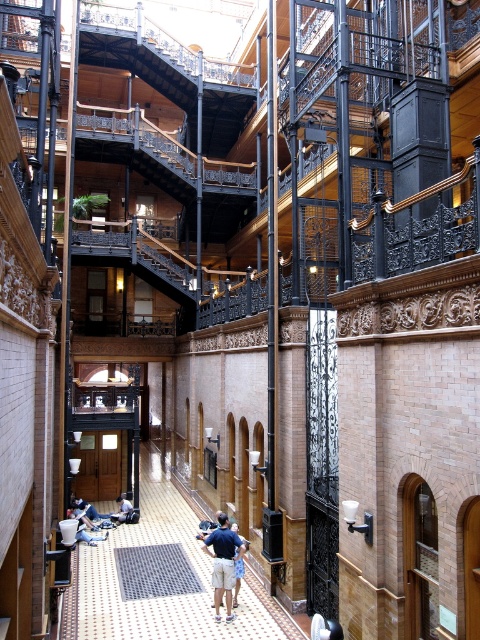
Question: Considering the real-world distances, which object is farthest from the metallic grid floor at center?

Choices:
 (A) blue denim shorts at center
 (B) polished wood corridor at center

Answer: (A)

Question: Which point is closer to the camera taking this photo?

Choices:
 (A) (126, 516)
 (B) (160, 570)

Answer: (B)

Question: Considering the real-world distances, which object is closest to the polished wood corridor at center?

Choices:
 (A) metallic grid floor at center
 (B) blue denim jeans at center
 (C) blue denim shorts at center

Answer: (A)

Question: Does polished wood corridor at center have a greater width compared to blue denim jeans at center?

Choices:
 (A) yes
 (B) no

Answer: (A)

Question: Does metallic grid floor at center lie behind blue denim shorts at center?

Choices:
 (A) yes
 (B) no

Answer: (A)

Question: Can you confirm if metallic grid floor at center is thinner than blue denim jeans at center?

Choices:
 (A) no
 (B) yes

Answer: (A)